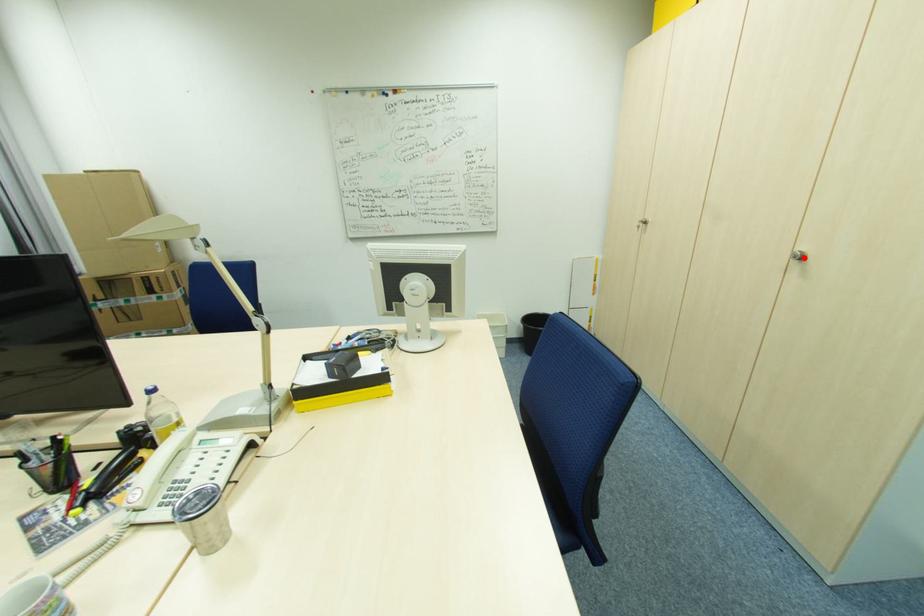
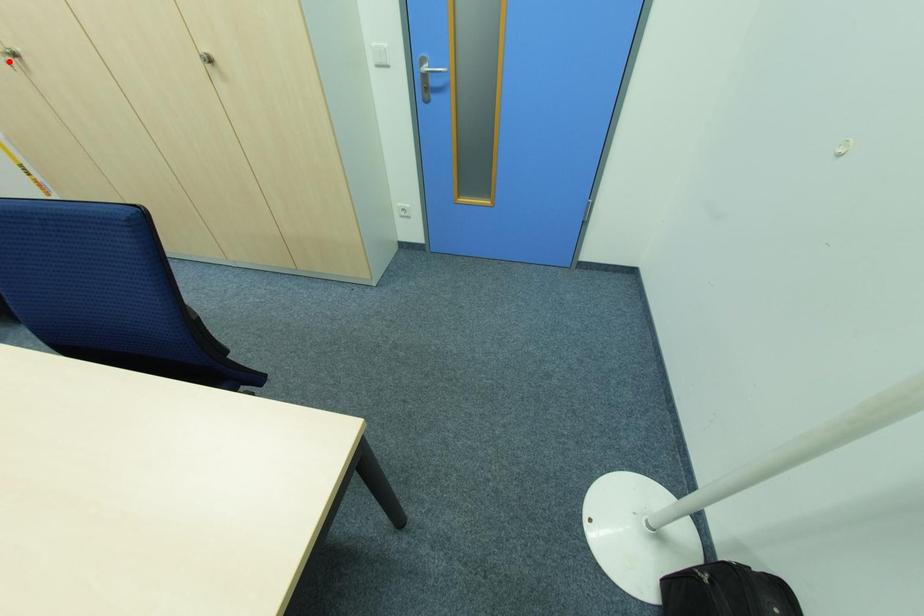
I am providing you with two images of the same scene from different viewpoints. A red point is marked on the first image and another point is marked on the second image. Does the point marked in image1 correspond to the same location as the one in image2?

No